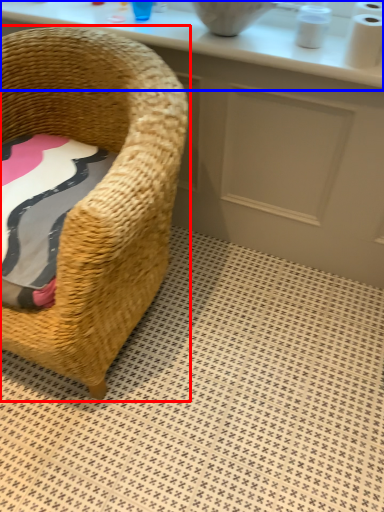
Question: Which point is further to the camera, chair (highlighted by a red box) or counter top (highlighted by a blue box)?

Choices:
 (A) chair
 (B) counter top

Answer: (B)